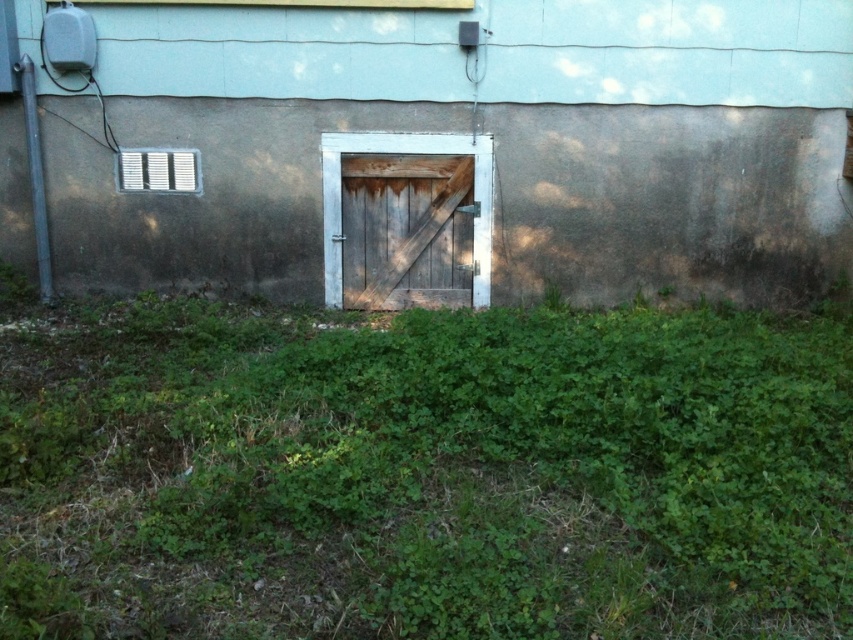
You are standing in front of the building with the light blue and grayish brown wall. There are two points marked on the wall, point 1 at coordinates point (26, 634) and point 2 at coordinates point (68, 68). From your perspective, which point is closer to you?

Point 1 at coordinates point (26, 634) is closer to you because it is in front of point 2 at coordinates point (68, 68).

You are a gardener who needs to mow the green leafy grass at center near the rusty wood door at center. Based on the scene, can you determine if the grass is tall enough to require mowing?

The green leafy grass at center is much taller than the rusty wood door at center, so yes, the grass is tall enough to require mowing.

You are standing in front of the building and see the green leafy grass at center. Based on its coordinates, can you tell me whether it is located to the left or right side of the door?

The green leafy grass at center is located at point coordinates of 0.742 on the x axis and 0.499 on the y axis. Since the x coordinate is greater than 0.5, it is positioned to the right side of the door.